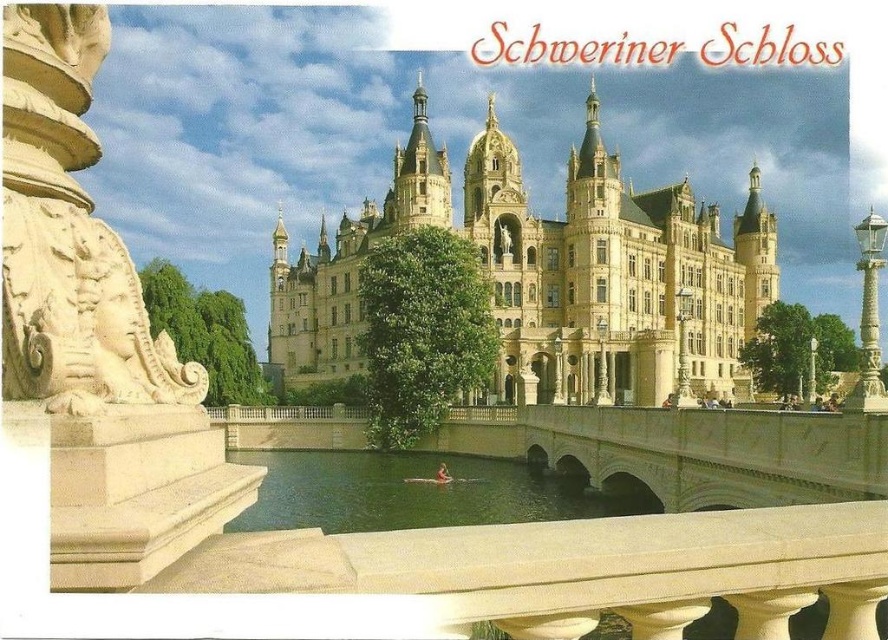
Question: Observing the image, what is the correct spatial positioning of yellow stone castle at center in reference to green water at center?

Choices:
 (A) left
 (B) right

Answer: (B)

Question: Is yellow stone castle at center to the right of green water at center from the viewer's perspective?

Choices:
 (A) yes
 (B) no

Answer: (A)

Question: Is yellow stone castle at center closer to the viewer compared to green water at center?

Choices:
 (A) no
 (B) yes

Answer: (A)

Question: Among these objects, which one is farthest from the camera?

Choices:
 (A) yellow stone castle at center
 (B) green water at center

Answer: (A)

Question: Which of the following is the closest to the observer?

Choices:
 (A) green water at center
 (B) yellow stone castle at center

Answer: (A)